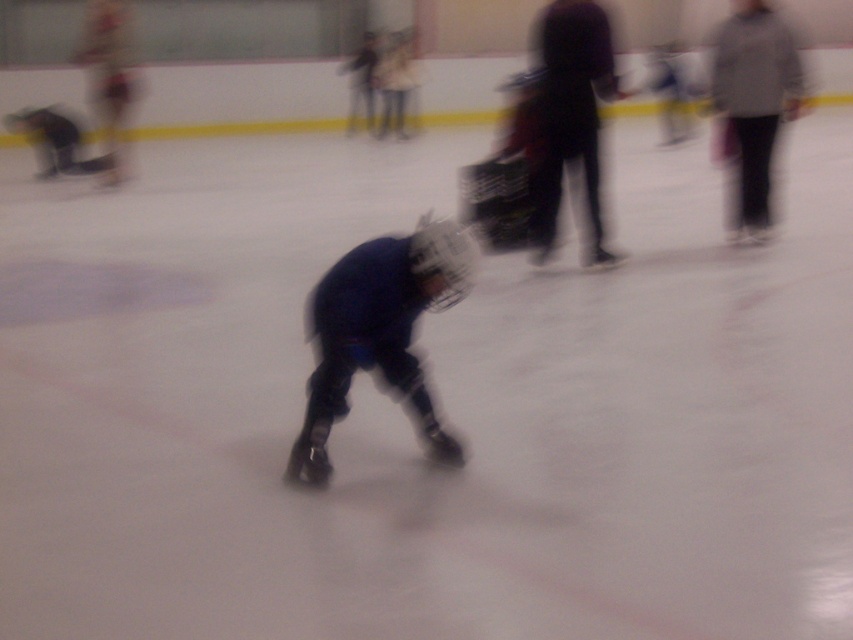
You are a photographer at the indoor ice skating rink. You want to take a photo of the blue padded jacket at center and the gray wool sweater at upper right. Which object should you focus on first to ensure both are in the frame?

The blue padded jacket at center is in front of the gray wool sweater at upper right, so you should focus on the blue padded jacket at center first to ensure both are in the frame.

You are standing at the entrance of the ice skating rink and want to locate the child wearing the blue padded jacket at center. According to the coordinates provided, in which direction should you look to find them?

The blue padded jacket at center is located at point (x=378, y=332), which is near the center of the rink. Since you are at the entrance, you should look towards the center area to find the child wearing the blue padded jacket at center.

You are a photographer at the indoor ice skating rink. You want to take a photo of the blue padded jacket at center and the gray wool sweater at upper right. Which object should you focus on first if you want to capture both in the same frame without moving the camera?

The blue padded jacket at center is to the left of the gray wool sweater at upper right. Since the blue padded jacket at center is closer to the left edge of the frame, you should focus on it first to ensure both are in the same frame without moving the camera.